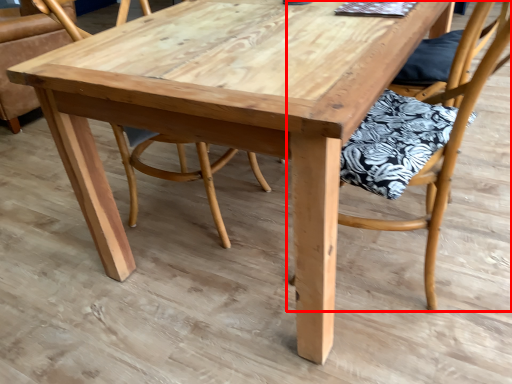
Question: In this image, where is chair (annotated by the red box) located relative to chair?

Choices:
 (A) left
 (B) right

Answer: (B)